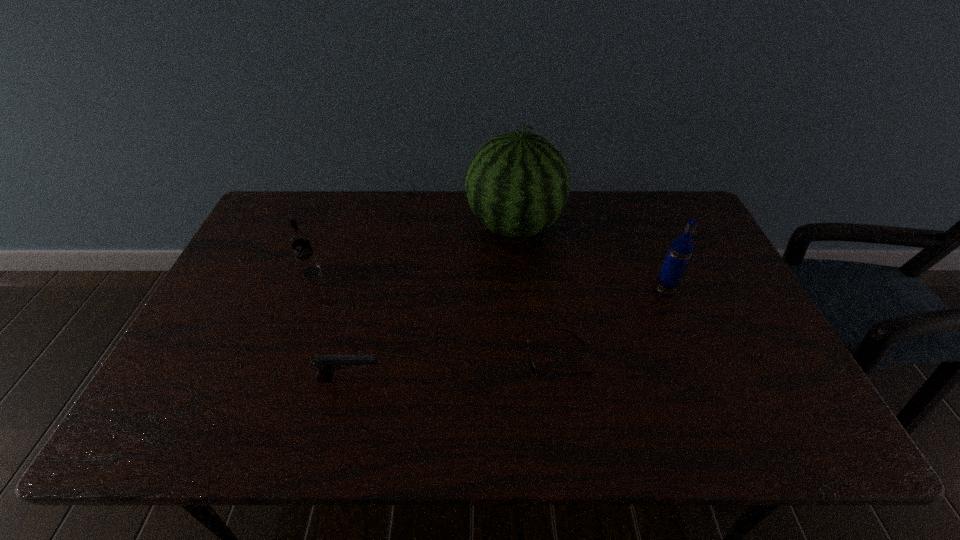
This screenshot has width=960, height=540. Find the location of `vacant space situated on the back of the second tallest object`. vacant space situated on the back of the second tallest object is located at coordinates (636, 218).

The width and height of the screenshot is (960, 540). In order to click on vacant region located on the label of the second farthest object in this screenshot , I will do `click(264, 394)`.

The height and width of the screenshot is (540, 960). Identify the location of free space located 0.260m at the barrel of the second shortest object. (493, 380).

The height and width of the screenshot is (540, 960). Identify the location of free space located on the front-facing side of the sunglasses. (391, 359).

Where is `vacant region located on the front-facing side of the sunglasses`? The image size is (960, 540). vacant region located on the front-facing side of the sunglasses is located at coordinates (423, 359).

Where is `free space located 0.320m on the front-facing side of the sunglasses`? The height and width of the screenshot is (540, 960). free space located 0.320m on the front-facing side of the sunglasses is located at coordinates (396, 359).

Find the location of a particular element. object located at the far edge is located at coordinates (517, 184).

Where is `blank space at the far edge of the desktop`? This screenshot has width=960, height=540. blank space at the far edge of the desktop is located at coordinates (451, 192).

Locate an element on the screen. The height and width of the screenshot is (540, 960). vacant space at the near edge of the desktop is located at coordinates (611, 431).

Image resolution: width=960 pixels, height=540 pixels. What are the coordinates of `free space at the left edge` in the screenshot? It's located at (269, 294).